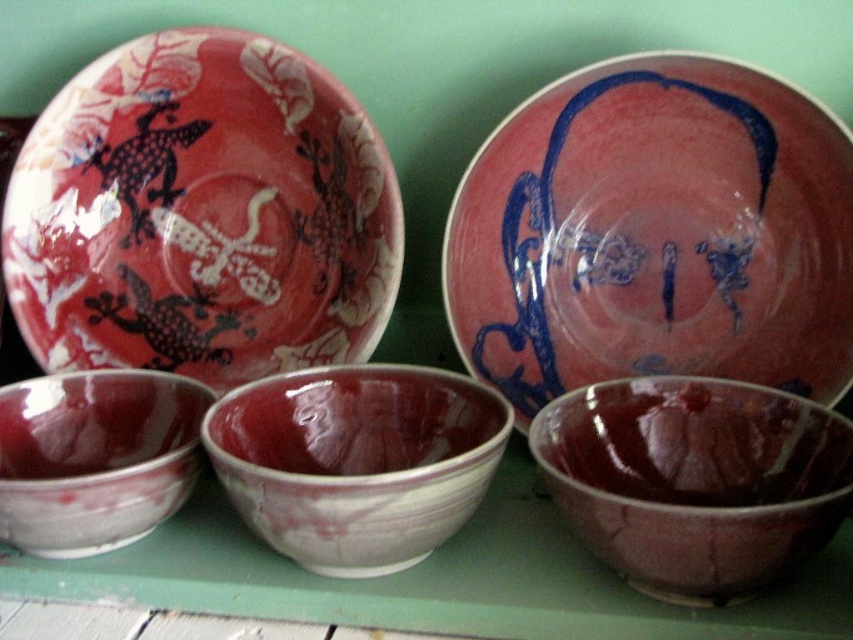
Can you confirm if matte pink plate at center is taller than matte porcelain bowl at lower left?

Yes, matte pink plate at center is taller than matte porcelain bowl at lower left.

Is matte pink plate at center above matte porcelain bowl at lower left?

Yes.

Image resolution: width=853 pixels, height=640 pixels. Describe the element at coordinates (654, 234) in the screenshot. I see `matte pink plate at center` at that location.

At what (x,y) coordinates should I click in order to perform the action: click on matte pink plate at center. Please return your answer as a coordinate pair (x, y). This screenshot has height=640, width=853. Looking at the image, I should click on (654, 234).

Between maroon glossy bowls at center and matte porcelain bowl at lower left, which one is positioned lower?

Positioned lower is maroon glossy bowls at center.

Between point (247, 531) and point (103, 486), which one is positioned behind?

The point (247, 531) is behind.

In order to click on maroon glossy bowls at center in this screenshot , I will do `click(436, 579)`.

Can you confirm if matte ceramic bowl at center is taller than matte porcelain bowl at lower left?

Yes.

Is point (461, 385) positioned after point (71, 497)?

That is True.

Between point (460, 476) and point (47, 548), which one is positioned in front?

Point (460, 476)

Where is `matte ceramic bowl at center`? This screenshot has height=640, width=853. matte ceramic bowl at center is located at coordinates (357, 461).